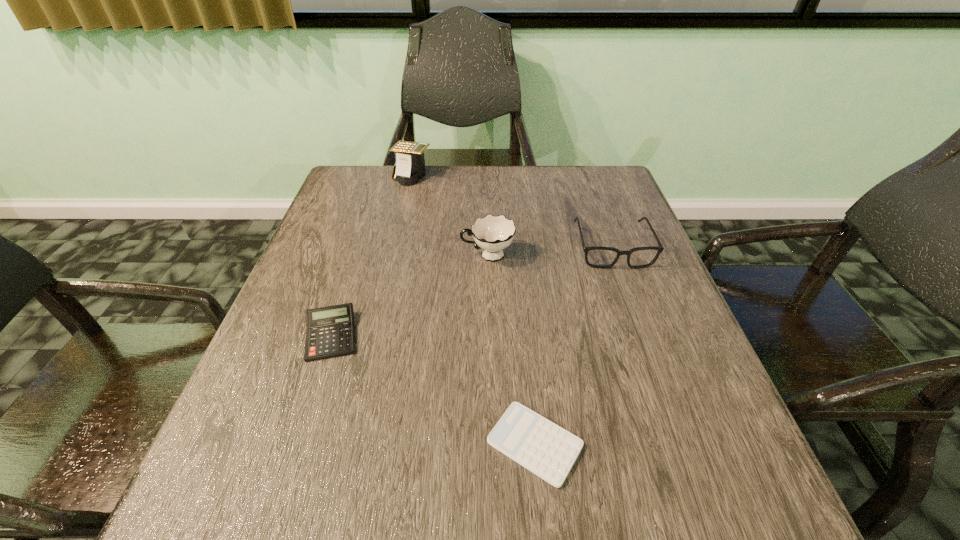
This screenshot has height=540, width=960. What are the coordinates of `free space between the cup and the second shortest object` in the screenshot? It's located at (409, 295).

Where is `unoccupied area between the fourth tallest object and the tallest calculator`? The image size is (960, 540). unoccupied area between the fourth tallest object and the tallest calculator is located at coordinates (372, 256).

Where is `empty location between the nearest object and the second tallest calculator`? empty location between the nearest object and the second tallest calculator is located at coordinates (433, 389).

This screenshot has height=540, width=960. Find the location of `vacant area between the cup and the third shortest object`. vacant area between the cup and the third shortest object is located at coordinates (550, 252).

Select which object appears as the fourth closest to the fourth tallest object. Please provide its 2D coordinates. Your answer should be formatted as a tuple, i.e. [(x, y)], where the tuple contains the x and y coordinates of a point satisfying the conditions above.

[(410, 163)]

Select which object appears as the second closest to the cup. Please provide its 2D coordinates. Your answer should be formatted as a tuple, i.e. [(x, y)], where the tuple contains the x and y coordinates of a point satisfying the conditions above.

[(330, 333)]

Where is `calculator that is the second closest to the second nearest calculator`? The width and height of the screenshot is (960, 540). calculator that is the second closest to the second nearest calculator is located at coordinates tap(410, 163).

Locate an element on the screen. Image resolution: width=960 pixels, height=540 pixels. calculator that is the second closest to the tallest calculator is located at coordinates (547, 450).

In order to click on vacant point that satisfies the following two spatial constraints: 1. on the front side of the farthest object; 2. on the left side of the shortest object in this screenshot , I will do `click(350, 443)`.

Find the location of a particular element. free location that satisfies the following two spatial constraints: 1. on the front side of the second farthest calculator; 2. on the right side of the nearest object is located at coordinates (296, 443).